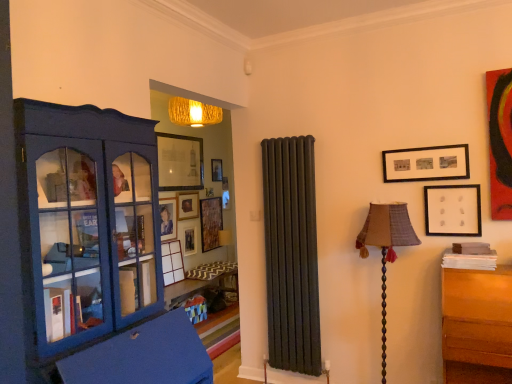
Question: From the image's perspective, is matte black picture frame at upper right, the 2th picture frame when ordered from right to left, positioned above or below matte wooden picture frame at center, positioned as the 3th picture frame in back-to-front order?

Choices:
 (A) above
 (B) below

Answer: (A)

Question: Does point (425, 162) appear closer or farther from the camera than point (169, 233)?

Choices:
 (A) closer
 (B) farther

Answer: (A)

Question: Estimate the real-world distances between objects in this image. Which object is closer to the textured fabric lampshade at right?

Choices:
 (A) white matte picture frame at upper right, the 1th picture frame when ordered from right to left
 (B) matte blue cabinet at left
 (C) wooden picture frame at left, which is the fifth picture frame from right to left
 (D) matte glass picture frame at upper center, which is the fifth picture frame from back to front
 (E) matte wooden picture frame at center, positioned as the 7th picture frame in right-to-left order

Answer: (A)

Question: Estimate the real-world distances between objects in this image. Which object is closer to the matte wooden picture frame at center, positioned as the 7th picture frame in right-to-left order?

Choices:
 (A) textured fabric lampshade at right
 (B) matte gold picture frame at center, placed as the second picture frame when sorted from back to front
 (C) matte blue cabinet at left
 (D) matte glass picture frame at upper center, marked as the second picture frame in a left-to-right arrangement
 (E) matte black picture frame at upper right, the 6th picture frame from the back

Answer: (B)